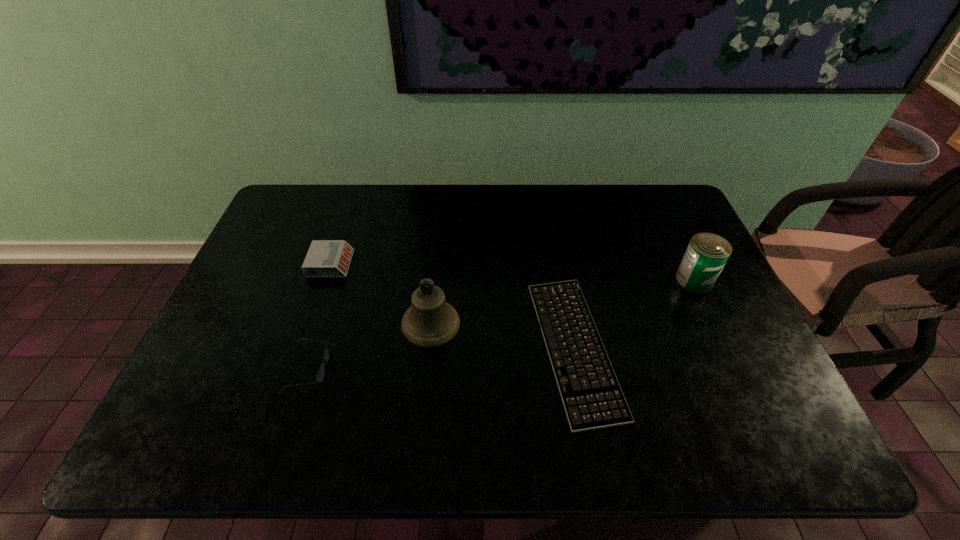
At what (x,y) coordinates should I click in order to perform the action: click on the third closest object to the computer keyboard. Please return your answer as a coordinate pair (x, y). This screenshot has height=540, width=960. Looking at the image, I should click on (320, 376).

Locate an element on the screen. The height and width of the screenshot is (540, 960). object that is the closest one to the tallest object is located at coordinates (320, 376).

Find the location of a particular element. free point that satisfies the following two spatial constraints: 1. on the front side of the third shortest object; 2. on the left side of the tallest object is located at coordinates (310, 323).

Where is `vacant space that satisfies the following two spatial constraints: 1. on the front side of the alarm clock; 2. on the left side of the third object from left to right`? This screenshot has height=540, width=960. vacant space that satisfies the following two spatial constraints: 1. on the front side of the alarm clock; 2. on the left side of the third object from left to right is located at coordinates (310, 323).

Locate an element on the screen. This screenshot has height=540, width=960. vacant space that satisfies the following two spatial constraints: 1. on the front side of the second object from right to left; 2. on the right side of the bell is located at coordinates (428, 347).

Image resolution: width=960 pixels, height=540 pixels. Find the location of `free space that satisfies the following two spatial constraints: 1. on the front side of the third shortest object; 2. on the right side of the third object from right to left`. free space that satisfies the following two spatial constraints: 1. on the front side of the third shortest object; 2. on the right side of the third object from right to left is located at coordinates (310, 323).